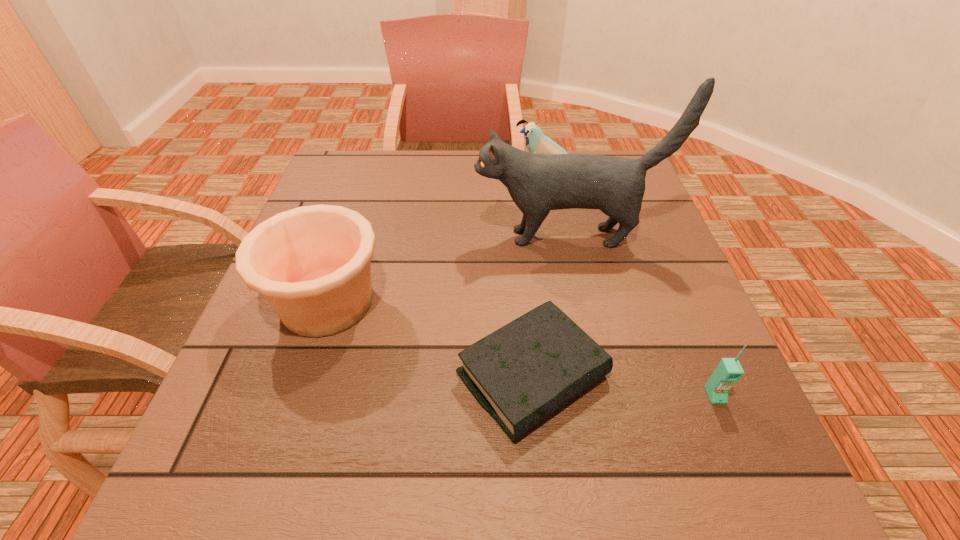
Identify the location of the tallest object. (537, 183).

This screenshot has height=540, width=960. Find the location of `the fourth nearest object`. the fourth nearest object is located at coordinates (537, 183).

Where is `the farthest object`? the farthest object is located at coordinates (536, 142).

Where is `the leftmost object`? The image size is (960, 540). the leftmost object is located at coordinates 312,264.

Locate an element on the screen. The image size is (960, 540). cellular telephone is located at coordinates (729, 370).

Find the location of a particular element. This screenshot has height=540, width=960. Bible is located at coordinates (523, 372).

Locate an element on the screen. This screenshot has height=540, width=960. vacant space located at the face of the fourth nearest object is located at coordinates (400, 237).

Locate an element on the screen. free space located 0.370m at the face of the fourth nearest object is located at coordinates (322, 237).

Locate an element on the screen. This screenshot has height=540, width=960. free space located 0.120m at the face of the fourth nearest object is located at coordinates (425, 237).

At what (x,y) coordinates should I click in order to perform the action: click on free region located at the face of the bird. Please return your answer as a coordinate pair (x, y). The width and height of the screenshot is (960, 540). Looking at the image, I should click on (401, 173).